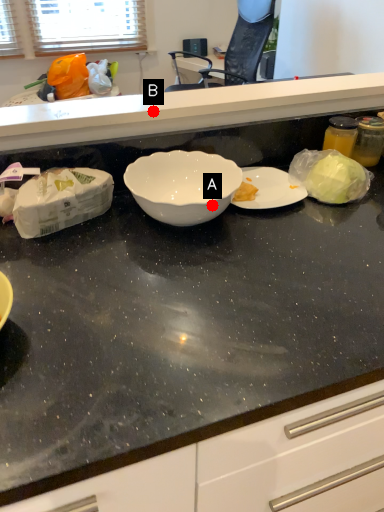
Question: Two points are circled on the image, labeled by A and B beside each circle. Among these points, which one is nearest to the camera?

Choices:
 (A) A is closer
 (B) B is closer

Answer: (A)